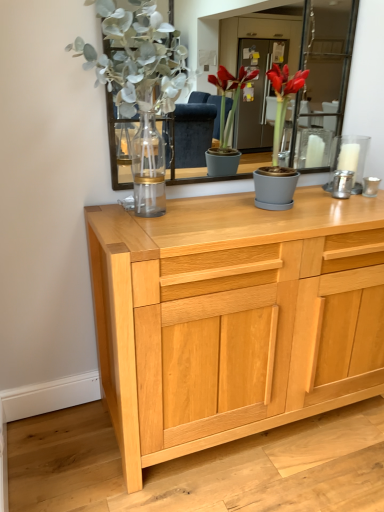
Question: Is silver metallic candle holder at right thinner than matte gray pot at center?

Choices:
 (A) yes
 (B) no

Answer: (A)

Question: From a real-world perspective, is silver metallic candle holder at right located beneath matte gray pot at center?

Choices:
 (A) yes
 (B) no

Answer: (A)

Question: Are silver metallic candle holder at right and matte gray pot at center beside each other?

Choices:
 (A) no
 (B) yes

Answer: (A)

Question: Does silver metallic candle holder at right appear on the left side of matte gray pot at center?

Choices:
 (A) yes
 (B) no

Answer: (B)

Question: Could you tell me if silver metallic candle holder at right is facing matte gray pot at center?

Choices:
 (A) no
 (B) yes

Answer: (A)

Question: From a real-world perspective, is matte glass vase at upper left above or below silver metallic candle holder at right?

Choices:
 (A) below
 (B) above

Answer: (B)

Question: In the image, is matte glass vase at upper left positioned in front of or behind silver metallic candle holder at right?

Choices:
 (A) front
 (B) behind

Answer: (A)

Question: From their relative heights in the image, would you say matte glass vase at upper left is taller or shorter than silver metallic candle holder at right?

Choices:
 (A) short
 (B) tall

Answer: (B)

Question: From the image's perspective, relative to silver metallic candle holder at right, is matte glass vase at upper left above or below?

Choices:
 (A) above
 (B) below

Answer: (A)

Question: Considering the positions of light wood cabinet at center and silver metallic candle holder at right in the image, is light wood cabinet at center wider or thinner than silver metallic candle holder at right?

Choices:
 (A) thin
 (B) wide

Answer: (B)

Question: Do you think light wood cabinet at center is within silver metallic candle holder at right, or outside of it?

Choices:
 (A) outside
 (B) inside

Answer: (A)

Question: Based on their sizes in the image, would you say light wood cabinet at center is bigger or smaller than silver metallic candle holder at right?

Choices:
 (A) big
 (B) small

Answer: (A)

Question: Is point (248, 296) closer or farther from the camera than point (354, 145)?

Choices:
 (A) closer
 (B) farther

Answer: (A)

Question: Is matte gray pot at center in front of or behind matte glass vase at upper left in the image?

Choices:
 (A) behind
 (B) front

Answer: (A)

Question: Is matte gray pot at center taller or shorter than matte glass vase at upper left?

Choices:
 (A) short
 (B) tall

Answer: (A)